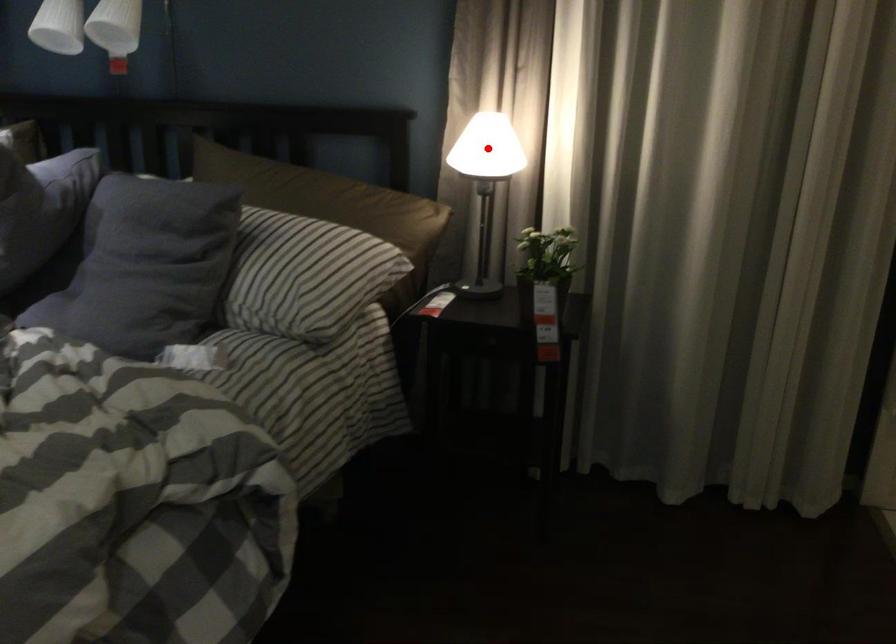
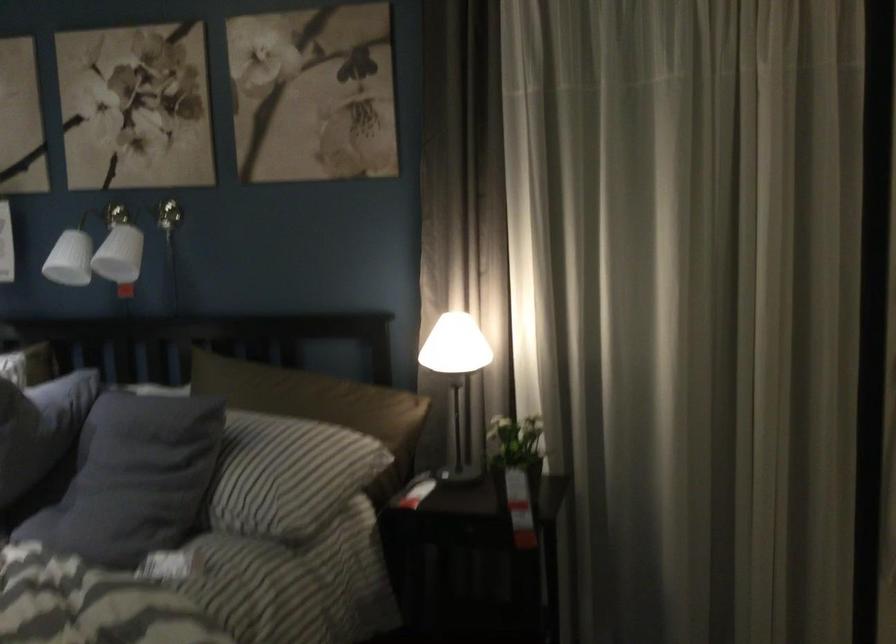
Find the pixel in the second image that matches the highlighted location in the first image.

(455, 345)